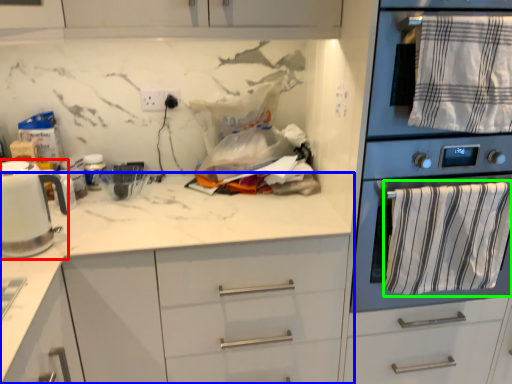
Question: Based on their relative distances, which object is farther from kitchen appliance (highlighted by a red box)? Choose from countertop (highlighted by a blue box) and bath towel (highlighted by a green box).

Choices:
 (A) countertop
 (B) bath towel

Answer: (B)